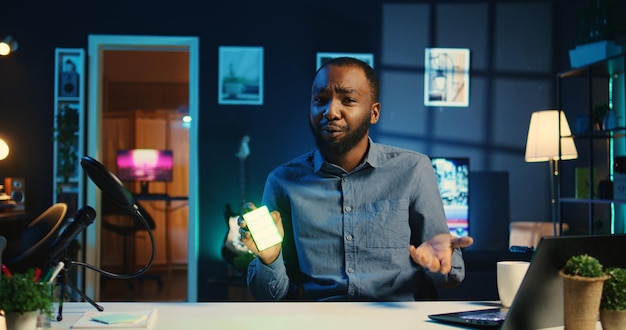
Where is `notepad`? This screenshot has height=330, width=626. notepad is located at coordinates (129, 313).